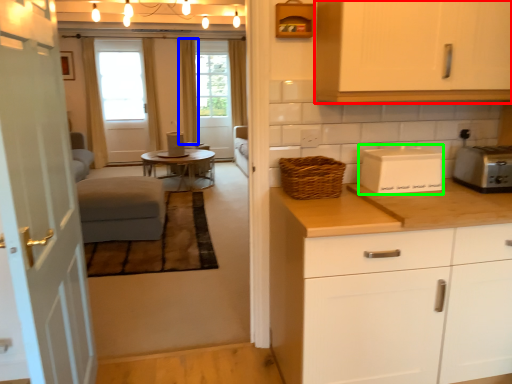
Question: Which object is positioned farthest from cabinetry (highlighted by a red box)? Select from curtain (highlighted by a blue box) and appliance (highlighted by a green box).

Choices:
 (A) curtain
 (B) appliance

Answer: (A)